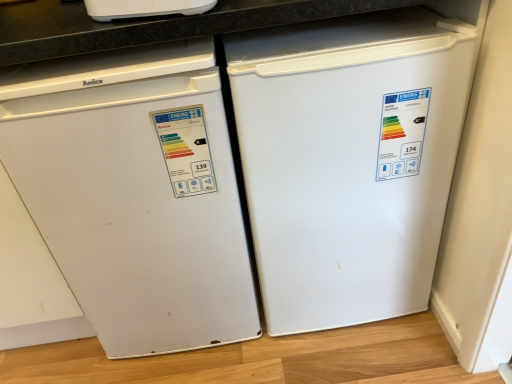
What do you see at coordinates (349, 160) in the screenshot? This screenshot has height=384, width=512. I see `white matte refrigerator at right` at bounding box center [349, 160].

At what (x,y) coordinates should I click in order to perform the action: click on white matte refrigerator at right. Please return your answer as a coordinate pair (x, y). The height and width of the screenshot is (384, 512). Looking at the image, I should click on (349, 160).

You are a GUI agent. You are given a task and a screenshot of the screen. Output one action in this format:
    pyautogui.click(x=<x>, y=<y>)
    Task: Click on the white matte refrigerator at left
    The height and width of the screenshot is (384, 512).
    Given the screenshot: What is the action you would take?
    pyautogui.click(x=136, y=195)

What do you see at coordinates (136, 195) in the screenshot?
I see `white matte refrigerator at left` at bounding box center [136, 195].

Where is `white matte refrigerator at right`? white matte refrigerator at right is located at coordinates (349, 160).

Between white matte refrigerator at right and white matte refrigerator at left, which one appears on the right side from the viewer's perspective?

white matte refrigerator at right.

Is white matte refrigerator at right positioned behind white matte refrigerator at left?

Yes, the depth of white matte refrigerator at right is greater than that of white matte refrigerator at left.

Between point (339, 114) and point (178, 89), which one is positioned in front?

The point (178, 89) is closer.

From the image's perspective, is white matte refrigerator at right above or below white matte refrigerator at left?

white matte refrigerator at right is situated higher than white matte refrigerator at left in the image.

From a real-world perspective, is white matte refrigerator at right physically located above or below white matte refrigerator at left?

white matte refrigerator at right is below white matte refrigerator at left.

Considering the relative sizes of white matte refrigerator at right and white matte refrigerator at left in the image provided, is white matte refrigerator at right wider than white matte refrigerator at left?

Correct, the width of white matte refrigerator at right exceeds that of white matte refrigerator at left.

Considering the relative sizes of white matte refrigerator at right and white matte refrigerator at left in the image provided, is white matte refrigerator at right shorter than white matte refrigerator at left?

Correct, white matte refrigerator at right is not as tall as white matte refrigerator at left.

Does white matte refrigerator at right have a smaller size compared to white matte refrigerator at left?

No, white matte refrigerator at right is not smaller than white matte refrigerator at left.

Is white matte refrigerator at right spatially inside white matte refrigerator at left, or outside of it?

white matte refrigerator at right is outside white matte refrigerator at left.

Is the surface of white matte refrigerator at right in direct contact with white matte refrigerator at left?

No, white matte refrigerator at right is not with white matte refrigerator at left.

Is white matte refrigerator at right looking in the opposite direction of white matte refrigerator at left?

white matte refrigerator at right is not turned away from white matte refrigerator at left.

Image resolution: width=512 pixels, height=384 pixels. I want to click on home appliance to the left of white matte refrigerator at right, so click(136, 195).

Looking at this image, is white matte refrigerator at left to the left of white matte refrigerator at right from the viewer's perspective?

Yes.

Considering the positions of objects white matte refrigerator at left and white matte refrigerator at right in the image provided, who is behind, white matte refrigerator at left or white matte refrigerator at right?

white matte refrigerator at right.

Does point (138, 199) lie behind point (421, 206)?

No, it is not.

From the image's perspective, which is below, white matte refrigerator at left or white matte refrigerator at right?

white matte refrigerator at left is shown below in the image.

From a real-world perspective, who is located higher, white matte refrigerator at left or white matte refrigerator at right?

From a 3D spatial view, white matte refrigerator at left is above.

Can you confirm if white matte refrigerator at left is thinner than white matte refrigerator at right?

Yes.

Which of these two, white matte refrigerator at left or white matte refrigerator at right, stands shorter?

white matte refrigerator at right.

Can you confirm if white matte refrigerator at left is bigger than white matte refrigerator at right?

Incorrect, white matte refrigerator at left is not larger than white matte refrigerator at right.

Is white matte refrigerator at left not within white matte refrigerator at right?

Yes, white matte refrigerator at left is not within white matte refrigerator at right.

Is white matte refrigerator at left far away from white matte refrigerator at right?

That's not correct — white matte refrigerator at left is a little close to white matte refrigerator at right.

Looking at this image, is white matte refrigerator at left facing away from white matte refrigerator at right?

No.

Can you tell me how much white matte refrigerator at left and white matte refrigerator at right differ in facing direction?

The angular difference between white matte refrigerator at left and white matte refrigerator at right is 0.000176 degrees.

The image size is (512, 384). In order to click on refrigerator above the white matte refrigerator at left (from the image's perspective) in this screenshot , I will do `click(349, 160)`.

You are a GUI agent. You are given a task and a screenshot of the screen. Output one action in this format:
    pyautogui.click(x=<x>, y=<y>)
    Task: Click on the home appliance lying below the white matte refrigerator at right (from the image's perspective)
    The height and width of the screenshot is (384, 512).
    Given the screenshot: What is the action you would take?
    point(136,195)

There is a white matte refrigerator at right. Identify the location of home appliance above it (from a real-world perspective). (136, 195).